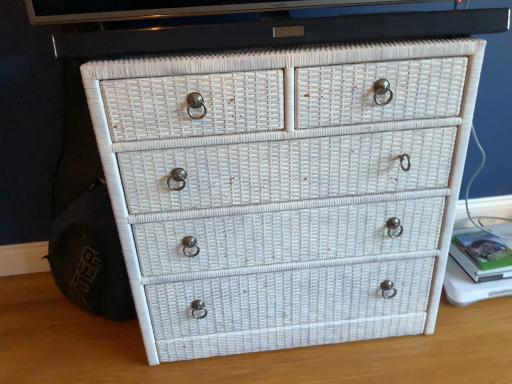
Locate an element on the screen. green matte book at right is located at coordinates (482, 254).

Measure the distance between point (488,334) and camera.

The depth of point (488,334) is 4.26 feet.

Where is `white wicker drawer at center`? white wicker drawer at center is located at coordinates (241, 354).

You are a GUI agent. You are given a task and a screenshot of the screen. Output one action in this format:
    pyautogui.click(x=<x>, y=<y>)
    Task: Click on the green matte book at right
    This screenshot has height=384, width=512.
    Given the screenshot: What is the action you would take?
    click(482, 254)

Is green matte book at right positioned far away from white wicker drawer at center?

No, there isn't a large distance between green matte book at right and white wicker drawer at center.

How far apart are green matte book at right and white wicker drawer at center?

green matte book at right and white wicker drawer at center are 18.47 inches apart from each other.

Is green matte book at right aimed at white wicker drawer at center?

No, green matte book at right is not facing towards white wicker drawer at center.

Is green matte book at right to the left or to the right of white wicker drawer at center in the image?

In the image, green matte book at right appears on the right side of white wicker drawer at center.

Are white wicker drawer at center and white wicker chest of drawers at center far apart?

No, white wicker drawer at center is not far away from white wicker chest of drawers at center.

Is white wicker drawer at center behind white wicker chest of drawers at center?

Yes, it is behind white wicker chest of drawers at center.

Is white wicker drawer at center to the left of white wicker chest of drawers at center from the viewer's perspective?

Indeed, white wicker drawer at center is positioned on the left side of white wicker chest of drawers at center.

You are a GUI agent. You are given a task and a screenshot of the screen. Output one action in this format:
    pyautogui.click(x=<x>, y=<y>)
    Task: Click on the chest of drawers that is in front of the green matte book at right
    
    Given the screenshot: What is the action you would take?
    285,190

From their relative heights in the image, would you say white wicker chest of drawers at center is taller or shorter than green matte book at right?

white wicker chest of drawers at center is taller than green matte book at right.

Is white wicker chest of drawers at center positioned before green matte book at right?

Yes, the depth of white wicker chest of drawers at center is less than that of green matte book at right.

Which object is positioned more to the right, white wicker chest of drawers at center or green matte book at right?

green matte book at right.

Looking at this image, is white wicker chest of drawers at center facing towards white wicker drawer at center?

No.

Which is behind, point (327, 62) or point (483, 307)?

Point (483, 307)

Who is smaller, white wicker chest of drawers at center or white wicker drawer at center?

With smaller size is white wicker drawer at center.

Considering the sizes of white wicker chest of drawers at center and white wicker drawer at center in the image, is white wicker chest of drawers at center taller or shorter than white wicker drawer at center?

Clearly, white wicker chest of drawers at center is taller compared to white wicker drawer at center.

Is white wicker drawer at center situated inside green matte book at right or outside?

white wicker drawer at center is outside green matte book at right.

Does point (292, 370) lie behind point (488, 248)?

That is False.

Looking at this image, would you consider white wicker drawer at center to be distant from green matte book at right?

Actually, white wicker drawer at center and green matte book at right are a little close together.

From a real-world perspective, is white wicker drawer at center under green matte book at right?

Yes, from a real-world perspective, white wicker drawer at center is under green matte book at right.

Considering the sizes of objects green matte book at right and white wicker chest of drawers at center in the image provided, who is wider, green matte book at right or white wicker chest of drawers at center?

white wicker chest of drawers at center is wider.

Considering the positions of point (461, 232) and point (377, 218), is point (461, 232) closer or farther from the camera than point (377, 218)?

Point (461, 232) is positioned farther from the camera compared to point (377, 218).

Based on the photo, considering the relative sizes of green matte book at right and white wicker chest of drawers at center in the image provided, is green matte book at right taller than white wicker chest of drawers at center?

In fact, green matte book at right may be shorter than white wicker chest of drawers at center.

Is green matte book at right beside white wicker chest of drawers at center?

No, green matte book at right is not in contact with white wicker chest of drawers at center.

There is a white wicker drawer at center. Identify the location of book above it (from a real-world perspective). (482, 254).

At what (x,y) coordinates should I click in order to perform the action: click on table top located below the white wicker chest of drawers at center (from the image's perspective). Please return your answer as a coordinate pair (x, y). Looking at the image, I should click on (241, 354).

Estimate the real-world distances between objects in this image. Which object is closer to white wicker chest of drawers at center, white wicker drawer at center or green matte book at right?

white wicker drawer at center.

Estimate the real-world distances between objects in this image. Which object is further from white wicker drawer at center, white wicker chest of drawers at center or green matte book at right?

Based on the image, green matte book at right appears to be further to white wicker drawer at center.

Estimate the real-world distances between objects in this image. Which object is further from white wicker chest of drawers at center, green matte book at right or white wicker drawer at center?

Based on the image, green matte book at right appears to be further to white wicker chest of drawers at center.

Based on their spatial positions, is white wicker chest of drawers at center or white wicker drawer at center further from green matte book at right?

white wicker chest of drawers at center lies further to green matte book at right than the other object.

Looking at the image, which one is located further to white wicker drawer at center, green matte book at right or white wicker chest of drawers at center?

green matte book at right.

From the image, which object appears to be nearer to green matte book at right, white wicker drawer at center or white wicker chest of drawers at center?

Based on the image, white wicker drawer at center appears to be nearer to green matte book at right.

The height and width of the screenshot is (384, 512). What are the coordinates of `the chest of drawers situated between white wicker drawer at center and green matte book at right from left to right` in the screenshot? It's located at (285, 190).